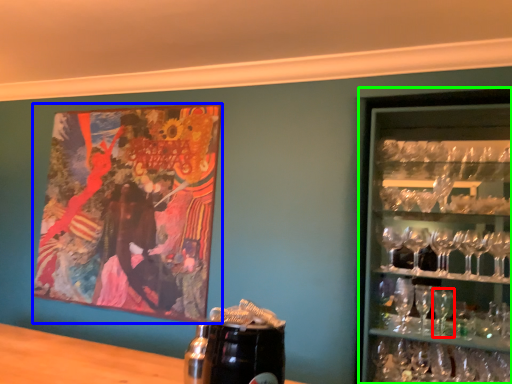
Question: Based on their relative distances, which object is farther from martini glass (highlighted by a red box)? Choose from picture frame (highlighted by a blue box) and shelf (highlighted by a green box).

Choices:
 (A) picture frame
 (B) shelf

Answer: (A)